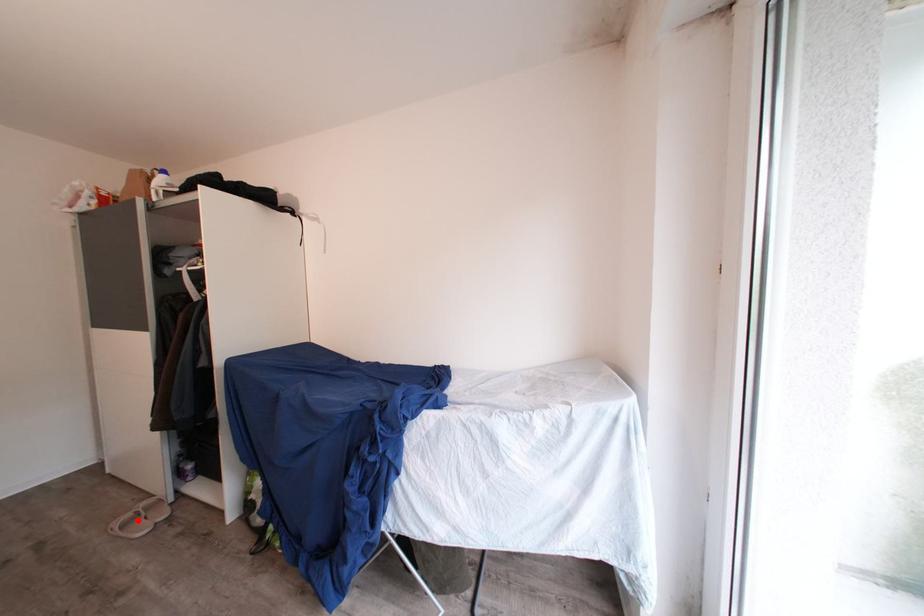
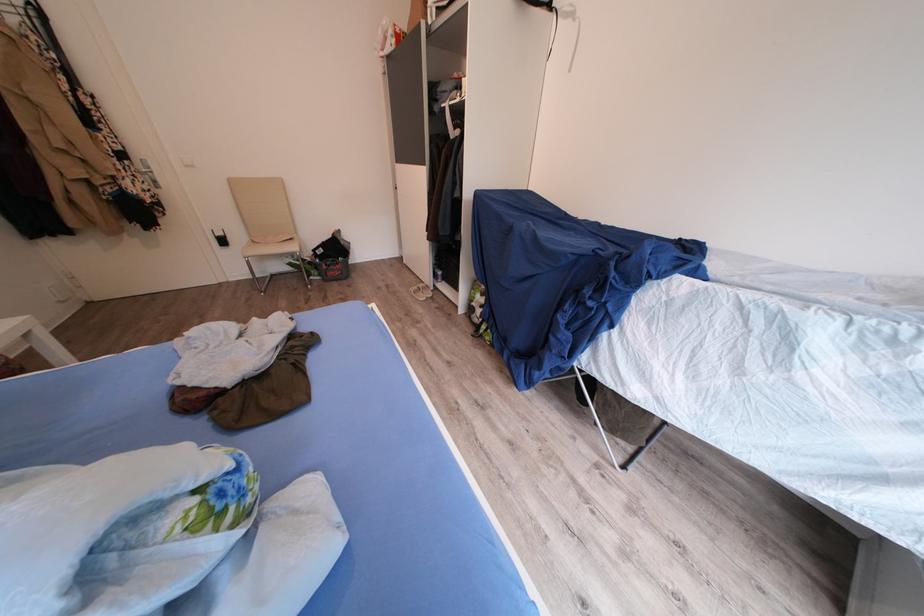
Question: I am providing you with two images of the same scene from different viewpoints. In image1, a red point is highlighted. Considering the same 3D point in image2, which of the following is correct?

Choices:
 (A) It is closer
 (B) It is farther

Answer: (B)